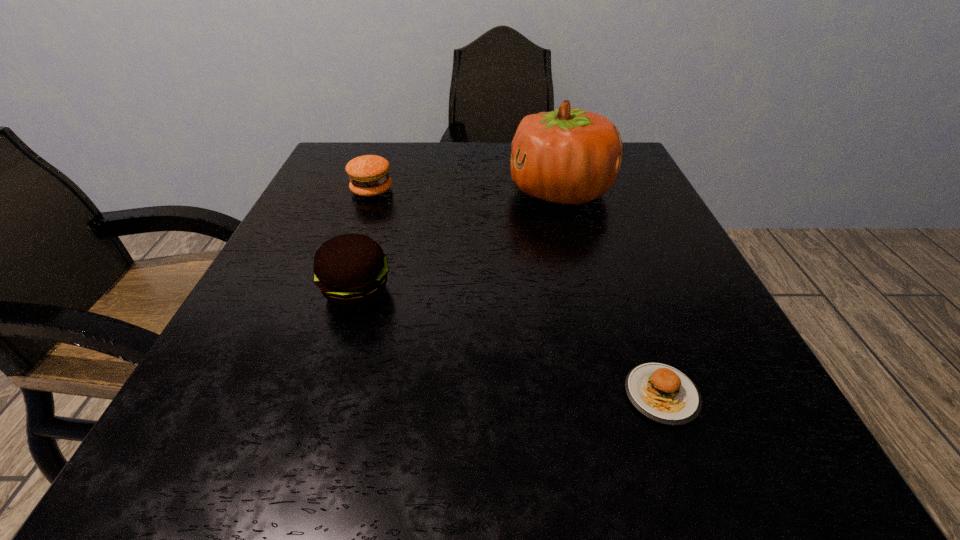
Identify the location of free space located on the right of the third shortest object. This screenshot has width=960, height=540. (584, 291).

This screenshot has height=540, width=960. Identify the location of vacant region located on the front of the second shortest food. (361, 220).

The image size is (960, 540). Find the location of `free point located on the left of the nearest object`. free point located on the left of the nearest object is located at coordinates (376, 395).

Find the location of `pumpkin located in the far edge section of the desktop`. pumpkin located in the far edge section of the desktop is located at coordinates (570, 156).

The height and width of the screenshot is (540, 960). Identify the location of patty present at the far edge. (368, 174).

Identify the location of object present at the near edge. (662, 393).

Where is `pumpkin located at the right edge`? Image resolution: width=960 pixels, height=540 pixels. pumpkin located at the right edge is located at coordinates (570, 156).

Where is `food present at the right edge`? food present at the right edge is located at coordinates (662, 393).

Image resolution: width=960 pixels, height=540 pixels. Identify the location of object situated at the far left corner. (368, 174).

Locate an element on the screen. This screenshot has width=960, height=540. object that is at the far right corner is located at coordinates (570, 156).